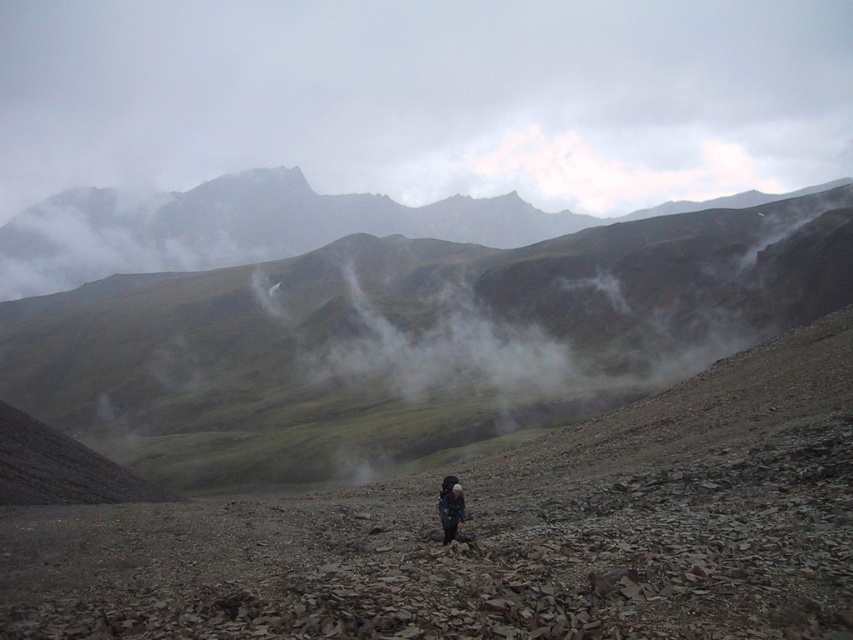
Question: Is rugged brown mountain at center bigger than dark blue fabric backpack at center?

Choices:
 (A) yes
 (B) no

Answer: (A)

Question: Can you confirm if rugged brown mountain at center is positioned above dark blue fabric backpack at center?

Choices:
 (A) no
 (B) yes

Answer: (B)

Question: Can you confirm if rugged brown mountain at center is positioned to the right of dark blue fabric backpack at center?

Choices:
 (A) yes
 (B) no

Answer: (B)

Question: Which point appears closest to the camera in this image?

Choices:
 (A) [647, 262]
 (B) [453, 512]

Answer: (B)